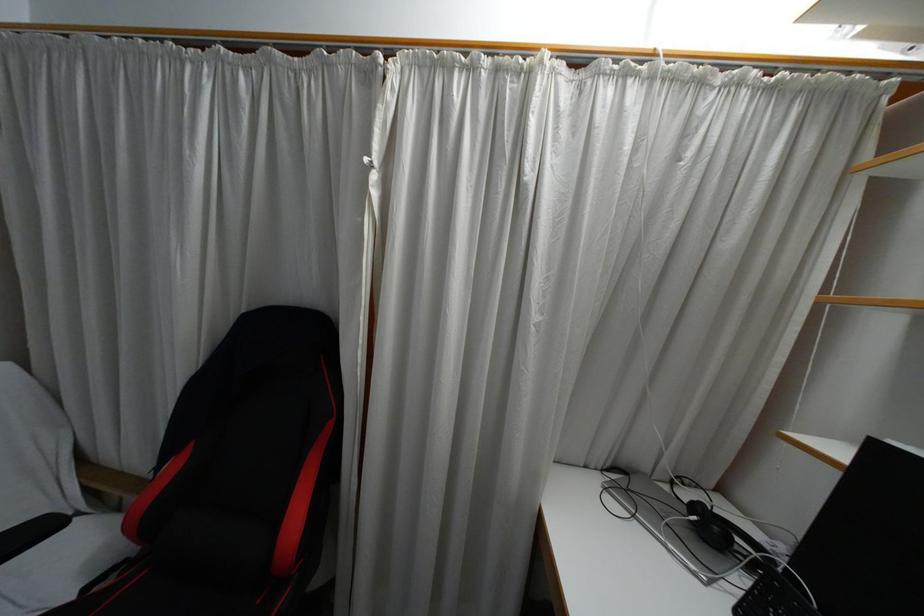
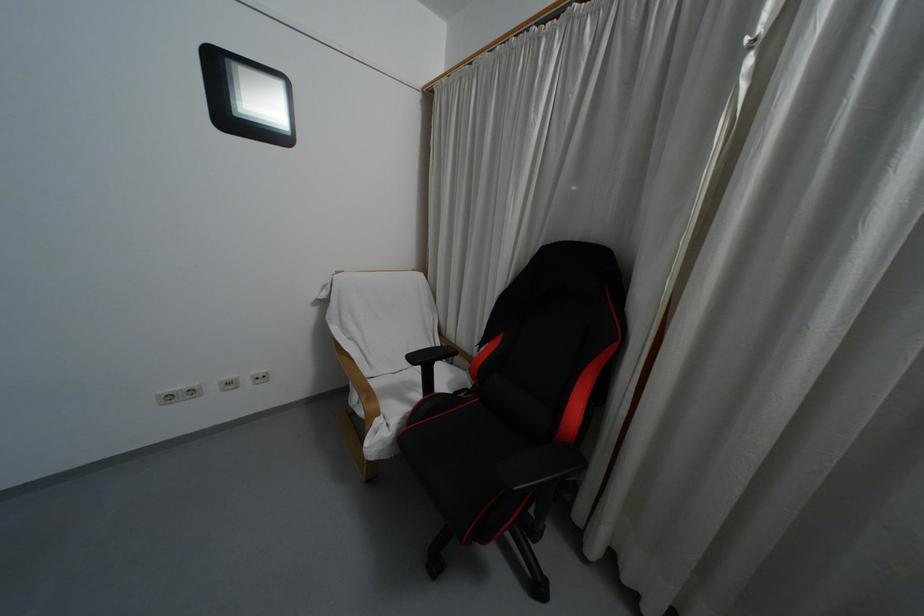
Question: The camera is either moving clockwise (left) or counter-clockwise (right) around the object. The first image is from the beginning of the video and the second image is from the end. Is the camera moving left or right when shooting the video?

Choices:
 (A) Left
 (B) Right

Answer: (B)